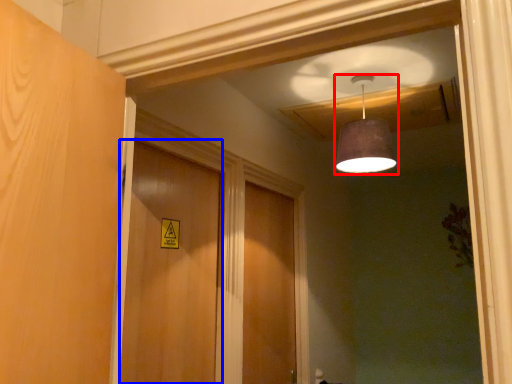
Question: Which of the following is the closest to the observer, lamp (highlighted by a red box) or door (highlighted by a blue box)?

Choices:
 (A) lamp
 (B) door

Answer: (B)